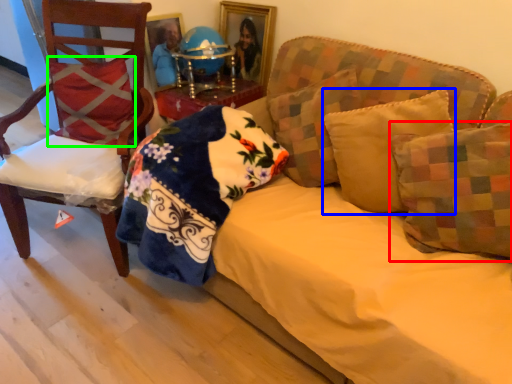
Question: Which object is the farthest from pillow (highlighted by a red box)? Choose among these: pillow (highlighted by a blue box) or pillow (highlighted by a green box).

Choices:
 (A) pillow
 (B) pillow

Answer: (B)